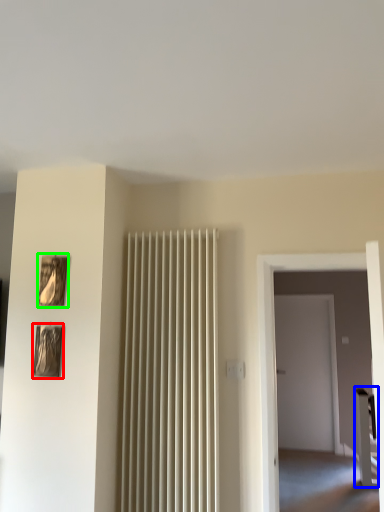
Question: Which object is the farthest from picture frame (highlighted by a red box)? Choose among these: furniture (highlighted by a blue box) or picture frame (highlighted by a green box).

Choices:
 (A) furniture
 (B) picture frame

Answer: (A)